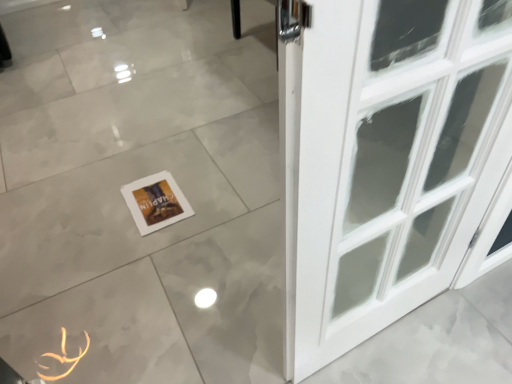
The height and width of the screenshot is (384, 512). In order to click on vacant area on top of white glossy tile at center (from a real-world perspective) in this screenshot , I will do `click(124, 83)`.